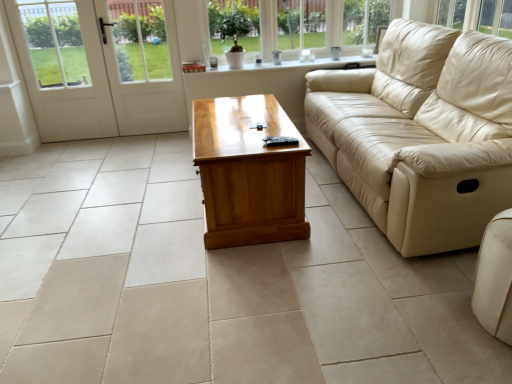
The image size is (512, 384). I want to click on vacant space that is to the left of beige leather couch at lower right, the 1th studio couch in the bottom-to-top sequence, so click(435, 327).